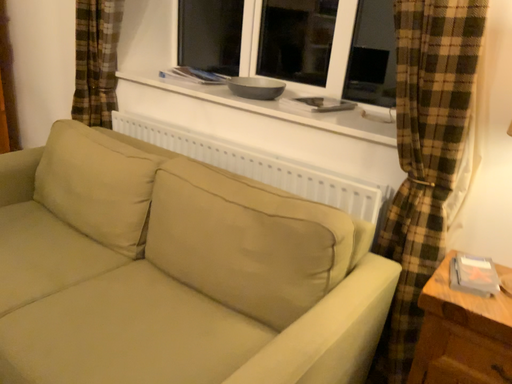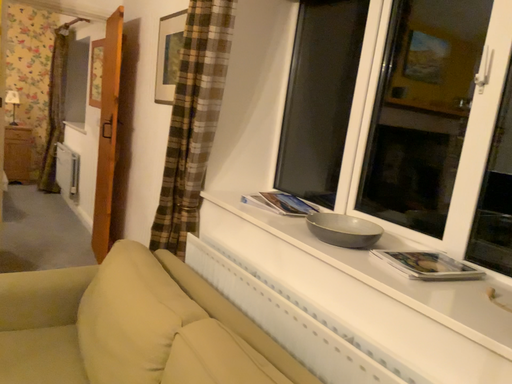
Question: Which way did the camera rotate in the video?

Choices:
 (A) rotated right
 (B) rotated left

Answer: (B)